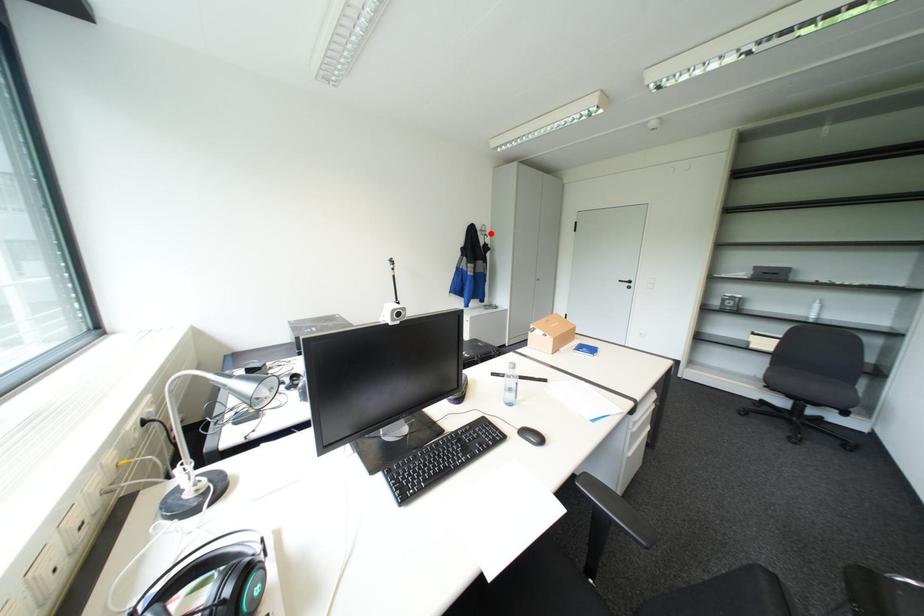
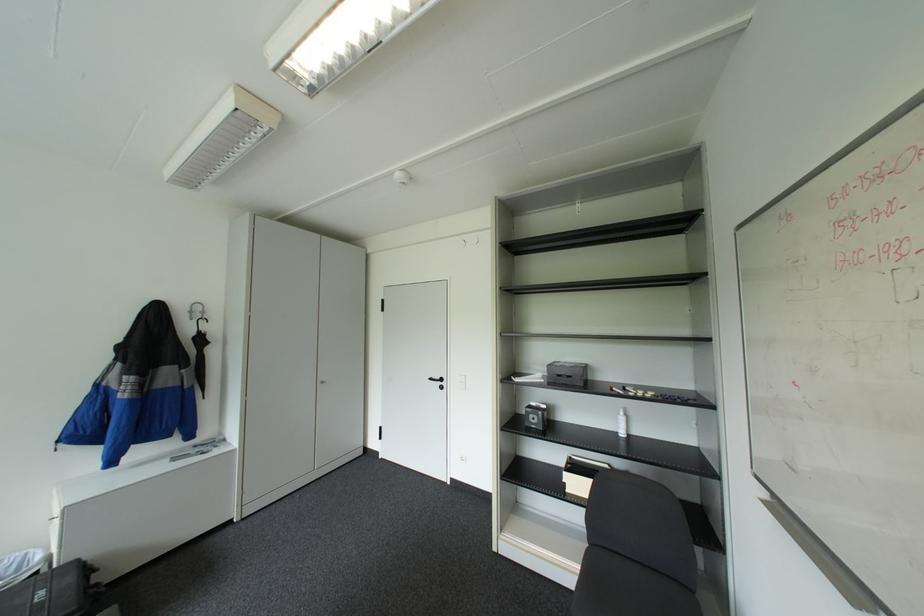
Question: I am providing you with two images of the same scene from different viewpoints. Image1 has a red point marked. In image2, the corresponding 3D location appears at what relative position? Reply with the corresponding letter.

Choices:
 (A) Closer
 (B) Farther

Answer: (B)